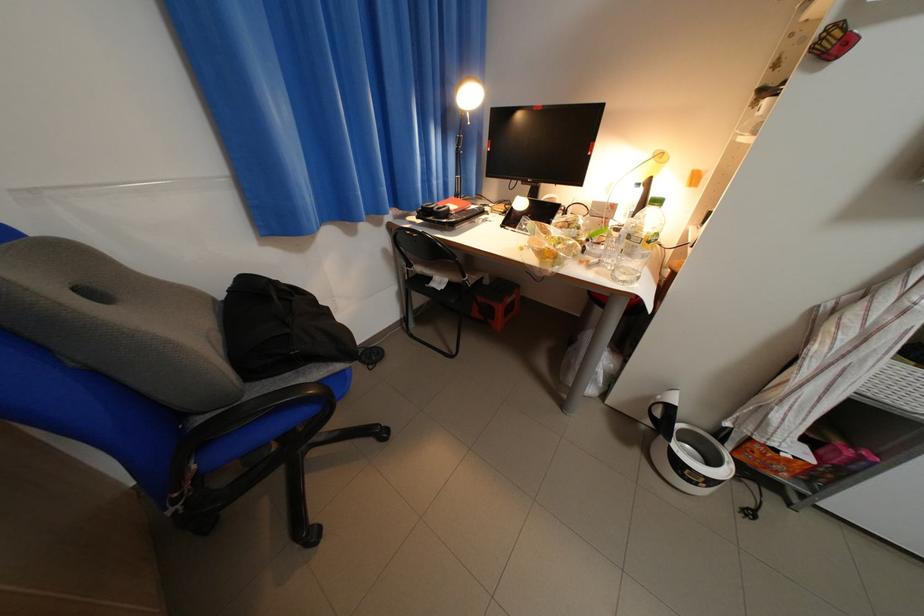
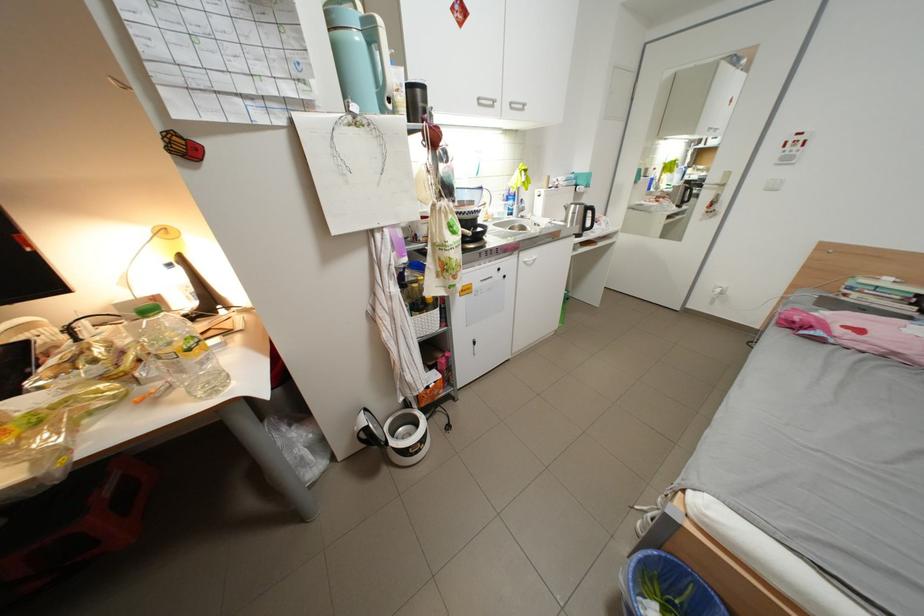
The point at (x=661, y=244) is marked in the first image. Where is the corresponding point in the second image?

(201, 351)